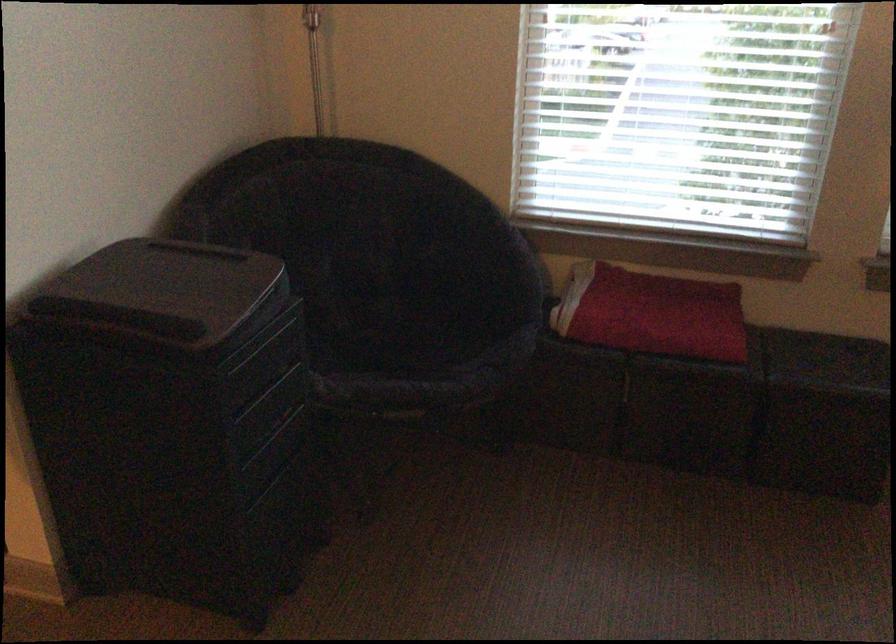
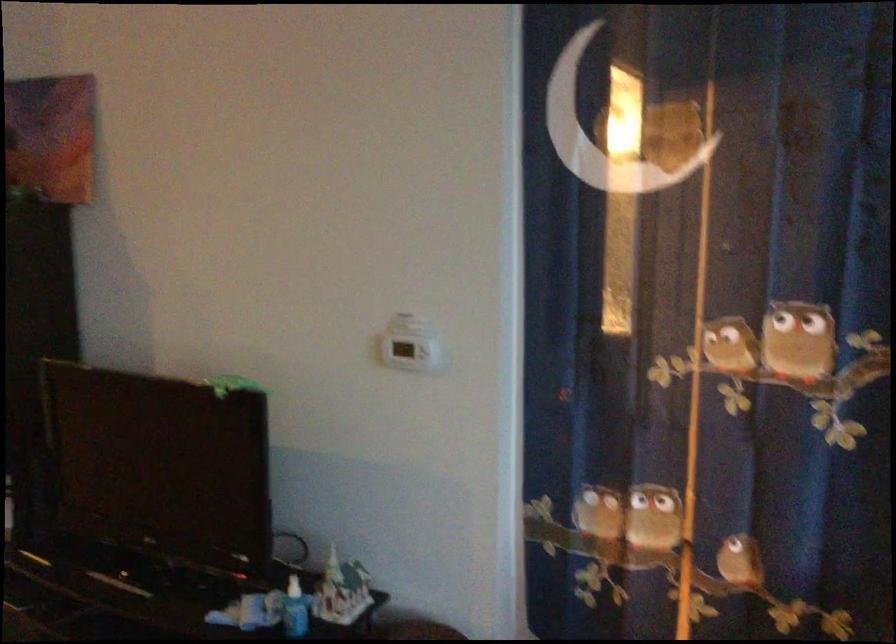
First-person continuous shooting, in which direction is the camera rotating?

The rotation direction of the camera is left-down.